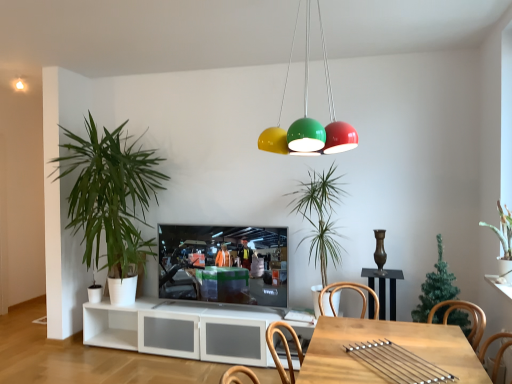
At what (x,y) coordinates should I click in order to perform the action: click on light brown wooden table at lower center. Please return your answer as a coordinate pair (x, y). The image size is (512, 384). Looking at the image, I should click on (394, 343).

This screenshot has width=512, height=384. Find the location of `green leafy plant at center, placed as the 2th houseplant when sorted from left to right`. green leafy plant at center, placed as the 2th houseplant when sorted from left to right is located at coordinates (320, 216).

This screenshot has width=512, height=384. Describe the element at coordinates (224, 264) in the screenshot. I see `matte black television at center` at that location.

Locate an element on the screen. The height and width of the screenshot is (384, 512). green matte christmas tree at center, which appears as the third houseplant when viewed from the left is located at coordinates (435, 287).

Describe the element at coordinates (435, 287) in the screenshot. I see `green matte christmas tree at center, the 2th houseplant when ordered from right to left` at that location.

Describe the element at coordinates (110, 195) in the screenshot. This screenshot has width=512, height=384. I see `green leafy plant at left, which is the fourth houseplant in right-to-left order` at that location.

At what (x,y) coordinates should I click in order to perform the action: click on light brown wooden table at lower center. Please return your answer as a coordinate pair (x, y). The image size is (512, 384). Looking at the image, I should click on (394, 343).

Would you say matte black television at center is inside or outside glossy plastic chandelier at upper center?

matte black television at center is located beyond the bounds of glossy plastic chandelier at upper center.

From a real-world perspective, is matte black television at center on glossy plastic chandelier at upper center?

No.

From the image's perspective, is matte black television at center above glossy plastic chandelier at upper center?

No, from the image's perspective, matte black television at center is not above glossy plastic chandelier at upper center.

Is matte black television at center placed right next to glossy plastic chandelier at upper center?

No.

Considering the positions of points (321, 223) and (201, 256), is point (321, 223) closer to camera compared to point (201, 256)?

Yes.

Is green leafy plant at center, placed as the 2th houseplant when sorted from left to right, to the left of matte black television at center from the viewer's perspective?

In fact, green leafy plant at center, placed as the 2th houseplant when sorted from left to right, is to the right of matte black television at center.

From a real-world perspective, which object stands above the other?

green leafy plant at center, placed as the 2th houseplant when sorted from left to right.

Consider the image. Considering the sizes of matte black television at center and green leafy plant at center, which is counted as the third houseplant, starting from the right, in the image, is matte black television at center bigger or smaller than green leafy plant at center, which is counted as the third houseplant, starting from the right,?

matte black television at center is smaller than green leafy plant at center, which is counted as the third houseplant, starting from the right.

Is matte black television at center further to camera compared to green leafy plant at center, which is counted as the third houseplant, starting from the right?

Yes, matte black television at center is behind green leafy plant at center, which is counted as the third houseplant, starting from the right.

From a real-world perspective, which is physically above, matte black television at center or green leafy plant at center, which is counted as the third houseplant, starting from the right?

green leafy plant at center, which is counted as the third houseplant, starting from the right, is physically above.

Considering the sizes of objects matte black television at center and green matte christmas tree at center, which appears as the third houseplant when viewed from the left, in the image provided, who is bigger, matte black television at center or green matte christmas tree at center, which appears as the third houseplant when viewed from the left,?

green matte christmas tree at center, which appears as the third houseplant when viewed from the left.

This screenshot has width=512, height=384. In the image, there is a green matte christmas tree at center, the 2th houseplant when ordered from right to left. In order to click on television below it (from a real-world perspective) in this screenshot , I will do `click(224, 264)`.

Considering the sizes of matte black television at center and green matte christmas tree at center, which appears as the third houseplant when viewed from the left, in the image, is matte black television at center wider or thinner than green matte christmas tree at center, which appears as the third houseplant when viewed from the left,?

In the image, matte black television at center appears to be more narrow than green matte christmas tree at center, which appears as the third houseplant when viewed from the left.

From a real-world perspective, is matte black television at center below green matte christmas tree at center, which appears as the third houseplant when viewed from the left?

Yes, from a real-world perspective, matte black television at center is under green matte christmas tree at center, which appears as the third houseplant when viewed from the left.

Which object is closer to the camera, green matte plant at upper right, which is the 4th houseplant in left-to-right order, or green matte christmas tree at center, the 2th houseplant when ordered from right to left?

green matte plant at upper right, which is the 4th houseplant in left-to-right order, is more forward.

Is green matte christmas tree at center, the 2th houseplant when ordered from right to left, located within green matte plant at upper right, which is the 4th houseplant in left-to-right order?

That's incorrect, green matte christmas tree at center, the 2th houseplant when ordered from right to left, is not inside green matte plant at upper right, which is the 4th houseplant in left-to-right order.

From the image's perspective, which object appears higher, green matte plant at upper right, which is the 4th houseplant in left-to-right order, or green matte christmas tree at center, which appears as the third houseplant when viewed from the left?

green matte plant at upper right, which is the 4th houseplant in left-to-right order.

From a real-world perspective, is green matte plant at upper right, which is the 4th houseplant in left-to-right order, physically located above or below green matte christmas tree at center, the 2th houseplant when ordered from right to left?

green matte plant at upper right, which is the 4th houseplant in left-to-right order, is above green matte christmas tree at center, the 2th houseplant when ordered from right to left.

From the image's perspective, is green leafy plant at left, which is the fourth houseplant in right-to-left order, under green leafy plant at center, placed as the 2th houseplant when sorted from left to right?

No, from the image's perspective, green leafy plant at left, which is the fourth houseplant in right-to-left order, is not beneath green leafy plant at center, placed as the 2th houseplant when sorted from left to right.

Is green leafy plant at left, which is the fourth houseplant in right-to-left order, at the right side of green leafy plant at center, which is counted as the third houseplant, starting from the right?

No.

What's the angular difference between green leafy plant at left, the 1th houseplant positioned from the left, and green leafy plant at center, placed as the 2th houseplant when sorted from left to right,'s facing directions?

The angle between the facing direction of green leafy plant at left, the 1th houseplant positioned from the left, and the facing direction of green leafy plant at center, placed as the 2th houseplant when sorted from left to right, is 2.26 degrees.

Is green leafy plant at left, which is the fourth houseplant in right-to-left order, touching green leafy plant at center, placed as the 2th houseplant when sorted from left to right?

green leafy plant at left, which is the fourth houseplant in right-to-left order, and green leafy plant at center, placed as the 2th houseplant when sorted from left to right, are not in contact.

From the image's perspective, is green matte christmas tree at center, which appears as the third houseplant when viewed from the left, above matte black television at center?

Yes, from the image's perspective, green matte christmas tree at center, which appears as the third houseplant when viewed from the left, is above matte black television at center.

Which is more to the left, green matte christmas tree at center, the 2th houseplant when ordered from right to left, or matte black television at center?

Positioned to the left is matte black television at center.

From the matte black television at center, count 2nd houseplant to the right and point to it. Please provide its 2D coordinates.

[(435, 287)]

Find the location of `television below the glossy plastic chandelier at upper center (from the image's perspective)`. television below the glossy plastic chandelier at upper center (from the image's perspective) is located at coordinates (224, 264).

The width and height of the screenshot is (512, 384). I want to click on the 2nd houseplant above when counting from the matte black television at center (from the image's perspective), so click(320, 216).

Which object lies nearer to the anchor point green matte christmas tree at center, the 2th houseplant when ordered from right to left, matte black television at center or green matte plant at upper right, the 1th houseplant in the right-to-left sequence?

The object closer to green matte christmas tree at center, the 2th houseplant when ordered from right to left, is green matte plant at upper right, the 1th houseplant in the right-to-left sequence.

Looking at the image, which one is located closer to glossy plastic chandelier at upper center, green leafy plant at center, placed as the 2th houseplant when sorted from left to right, or green matte christmas tree at center, which appears as the third houseplant when viewed from the left?

Among the two, green leafy plant at center, placed as the 2th houseplant when sorted from left to right, is located nearer to glossy plastic chandelier at upper center.

Looking at the image, which one is located closer to green leafy plant at left, the 1th houseplant positioned from the left, green matte plant at upper right, the 1th houseplant in the right-to-left sequence, or light brown wooden table at lower center?

light brown wooden table at lower center is closer to green leafy plant at left, the 1th houseplant positioned from the left.

In the scene shown: Based on their spatial positions, is green matte plant at upper right, the 1th houseplant in the right-to-left sequence, or green leafy plant at left, which is the fourth houseplant in right-to-left order, further from glossy plastic chandelier at upper center?

green leafy plant at left, which is the fourth houseplant in right-to-left order, is further to glossy plastic chandelier at upper center.

Looking at the image, which one is located closer to light brown wooden table at lower center, matte black television at center or green leafy plant at center, which is counted as the third houseplant, starting from the right?

green leafy plant at center, which is counted as the third houseplant, starting from the right.

Considering their positions, is green matte christmas tree at center, which appears as the third houseplant when viewed from the left, positioned further to green matte plant at upper right, which is the 4th houseplant in left-to-right order, than glossy plastic chandelier at upper center?

glossy plastic chandelier at upper center is further to green matte plant at upper right, which is the 4th houseplant in left-to-right order.

From the image, which object appears to be nearer to glossy plastic chandelier at upper center, green leafy plant at left, the 1th houseplant positioned from the left, or light brown wooden table at lower center?

green leafy plant at left, the 1th houseplant positioned from the left.

Which object lies further to the anchor point green matte christmas tree at center, the 2th houseplant when ordered from right to left, green leafy plant at center, placed as the 2th houseplant when sorted from left to right, or green leafy plant at left, which is the fourth houseplant in right-to-left order?

green leafy plant at left, which is the fourth houseplant in right-to-left order, is further to green matte christmas tree at center, the 2th houseplant when ordered from right to left.

Where is `television between green leafy plant at left, which is the fourth houseplant in right-to-left order, and green matte christmas tree at center, the 2th houseplant when ordered from right to left`? The width and height of the screenshot is (512, 384). television between green leafy plant at left, which is the fourth houseplant in right-to-left order, and green matte christmas tree at center, the 2th houseplant when ordered from right to left is located at coordinates (224, 264).

This screenshot has width=512, height=384. What are the coordinates of `houseplant between green leafy plant at left, the 1th houseplant positioned from the left, and green matte christmas tree at center, the 2th houseplant when ordered from right to left, from left to right` in the screenshot? It's located at (320, 216).

Locate an element on the screen. The height and width of the screenshot is (384, 512). houseplant situated between matte black television at center and green matte christmas tree at center, the 2th houseplant when ordered from right to left, from left to right is located at coordinates (320, 216).

Image resolution: width=512 pixels, height=384 pixels. Identify the location of television between green leafy plant at left, the 1th houseplant positioned from the left, and green leafy plant at center, which is counted as the third houseplant, starting from the right, from left to right. coord(224,264).